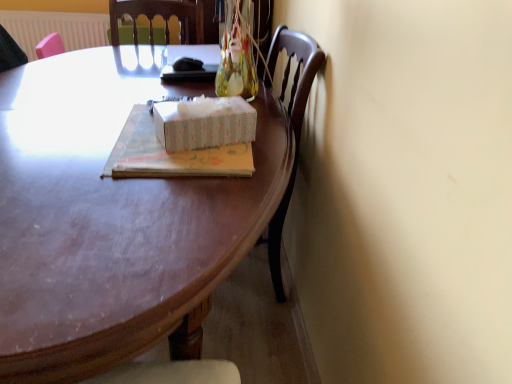
Find the location of `vacant area that lies in front of matte paper book at center`. vacant area that lies in front of matte paper book at center is located at coordinates point(139,213).